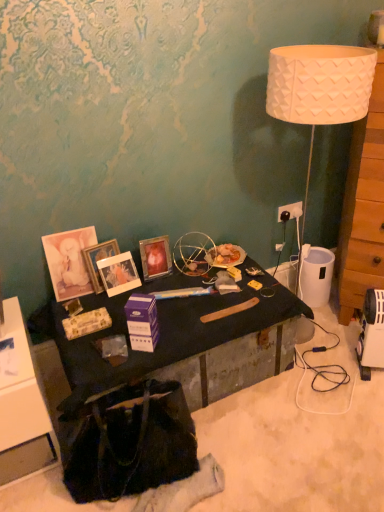
Question: Considering the relative sizes of matte black cabinet at lower left and black fabric handbag at lower left in the image provided, is matte black cabinet at lower left bigger than black fabric handbag at lower left?

Choices:
 (A) yes
 (B) no

Answer: (A)

Question: Is matte black cabinet at lower left outside of black fabric handbag at lower left?

Choices:
 (A) no
 (B) yes

Answer: (B)

Question: Is matte black cabinet at lower left thinner than black fabric handbag at lower left?

Choices:
 (A) yes
 (B) no

Answer: (B)

Question: Can you confirm if matte black cabinet at lower left is shorter than black fabric handbag at lower left?

Choices:
 (A) no
 (B) yes

Answer: (A)

Question: Considering the relative sizes of matte black cabinet at lower left and black fabric handbag at lower left in the image provided, is matte black cabinet at lower left wider than black fabric handbag at lower left?

Choices:
 (A) no
 (B) yes

Answer: (B)

Question: From the image's perspective, is purple cardboard box at center above or below black fabric handbag at lower left?

Choices:
 (A) below
 (B) above

Answer: (B)

Question: In the image, is purple cardboard box at center on the left side or the right side of black fabric handbag at lower left?

Choices:
 (A) left
 (B) right

Answer: (B)

Question: From a real-world perspective, is purple cardboard box at center physically located above or below black fabric handbag at lower left?

Choices:
 (A) below
 (B) above

Answer: (B)

Question: Based on their sizes in the image, would you say purple cardboard box at center is bigger or smaller than black fabric handbag at lower left?

Choices:
 (A) small
 (B) big

Answer: (A)

Question: From the image's perspective, is matte wooden picture frame at center left, the third picture frame in the right-to-left sequence, located above or below metallic gold picture frame at center, marked as the first picture frame in a right-to-left arrangement?

Choices:
 (A) below
 (B) above

Answer: (A)

Question: From a real-world perspective, is matte wooden picture frame at center left, positioned as the 1th picture frame in left-to-right order, above or below metallic gold picture frame at center, marked as the first picture frame in a right-to-left arrangement?

Choices:
 (A) above
 (B) below

Answer: (A)

Question: Is matte wooden picture frame at center left, positioned as the 1th picture frame in left-to-right order, to the left or to the right of metallic gold picture frame at center, marked as the first picture frame in a right-to-left arrangement, in the image?

Choices:
 (A) left
 (B) right

Answer: (A)

Question: Choose the correct answer: Is matte wooden picture frame at center left, positioned as the 1th picture frame in left-to-right order, inside metallic gold picture frame at center, arranged as the third picture frame when viewed from the left, or outside it?

Choices:
 (A) inside
 (B) outside

Answer: (B)

Question: Is wooden dresser at right in front of or behind metallic gold picture frame at center, acting as the second picture frame starting from the left, in the image?

Choices:
 (A) front
 (B) behind

Answer: (A)

Question: Looking at the image, does wooden dresser at right seem bigger or smaller compared to metallic gold picture frame at center, acting as the second picture frame starting from the left?

Choices:
 (A) small
 (B) big

Answer: (B)